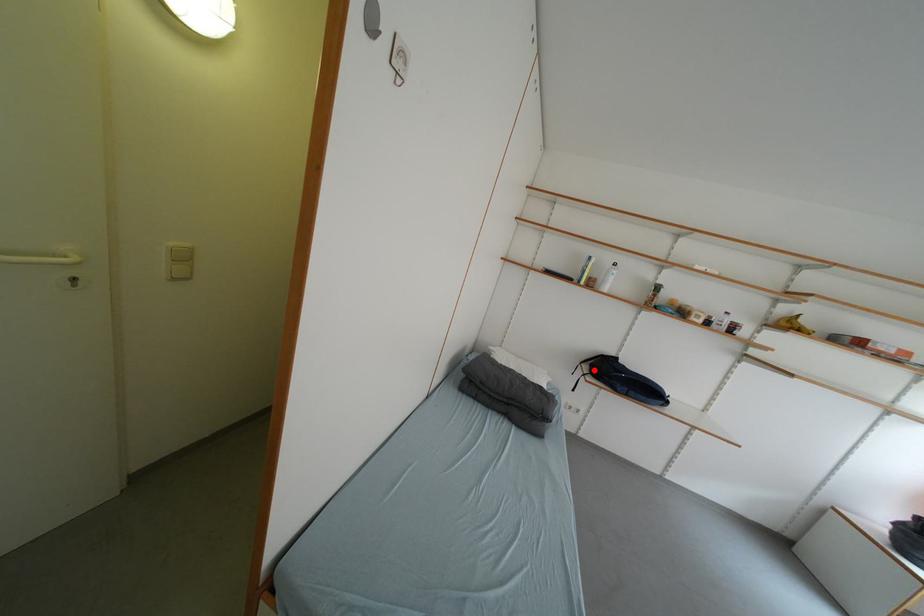
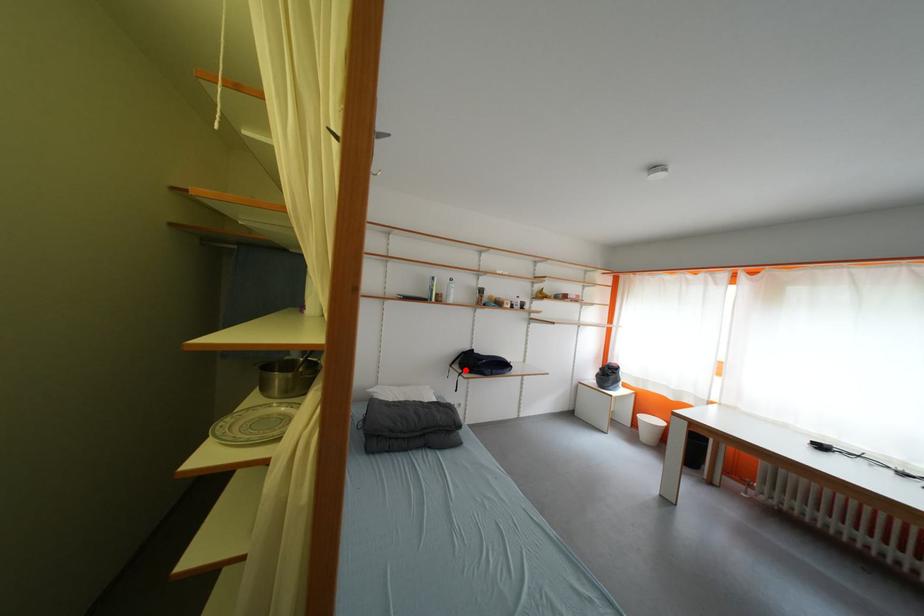
I am providing you with two images of the same scene from different viewpoints. A red point is marked on the first image and another point is marked on the second image. Do the highlighted points in image1 and image2 indicate the same real-world spot?

Yes